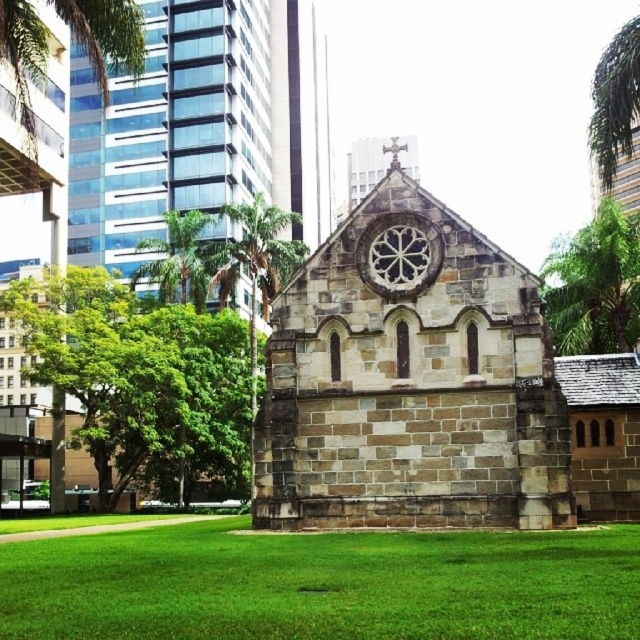
Consider the image. You are standing at the center of the grassy area in front of the historic stone church. You see a green leafy tree at lower left. Can you determine if the tree is positioned to your left or right side?

The green leafy tree at lower left is located at point coordinates, which places it to your left side relative to your position at the center of the grassy area.

You are a city planner analyzing the urban landscape. You notice the green leafy tree at lower left and the green leafy palm tree at upper left. Which of these two trees has a greater height?

The green leafy tree at lower left has a larger size compared to the green leafy palm tree at upper left, so it is taller.